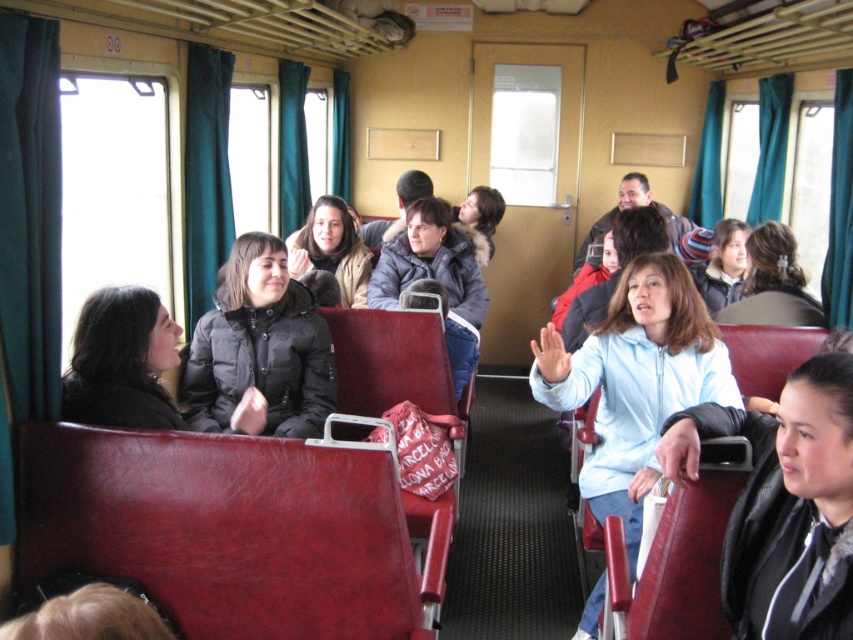
Question: Does black leather jacket at center have a larger size compared to black puffy jacket at center?

Choices:
 (A) no
 (B) yes

Answer: (A)

Question: Observing the image, what is the correct spatial positioning of black leather jacket at center in reference to black puffy jacket at center?

Choices:
 (A) left
 (B) right

Answer: (B)

Question: Among these objects, which one is farthest from the camera?

Choices:
 (A) black puffy jacket at center
 (B) black leather jacket at center

Answer: (A)

Question: Which point is closer to the camera taking this photo?

Choices:
 (A) (811, 595)
 (B) (309, 385)

Answer: (A)

Question: Is black leather jacket at center bigger than black puffy jacket at center?

Choices:
 (A) no
 (B) yes

Answer: (A)